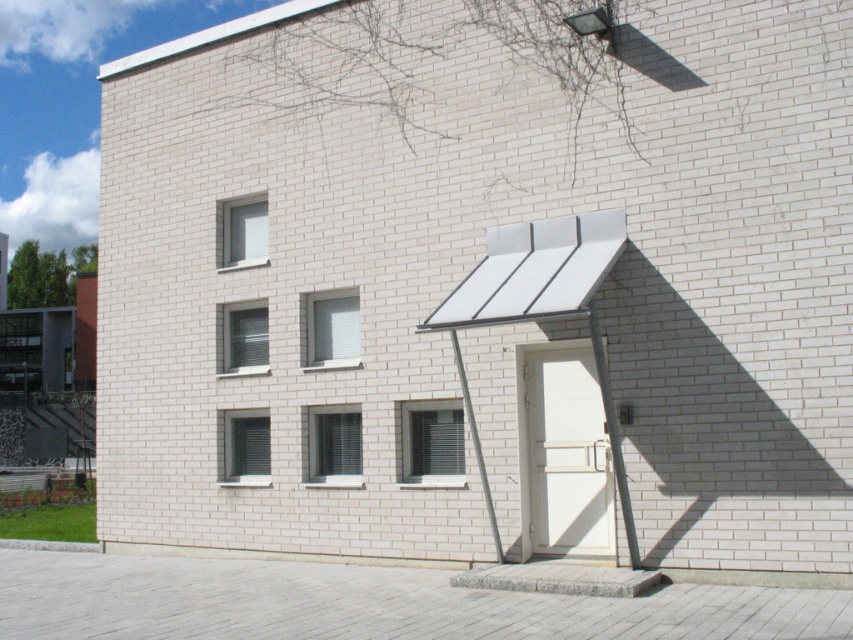
You are an architect designing a new building and want to ensure proper ventilation. You notice the clear glass window at center and the white textured window at lower left. Which window should you open if you want to allow more airflow without blocking the view, considering their heights?

The clear glass window at center has a lesser height compared to the white textured window at lower left, so opening the white textured window at lower left would allow more airflow while maintaining a clear view since it is taller.

You are an architect evaluating the building facade. You notice the white glass window at upper center and the metallic gray pole at center. Which object has a smaller size?

The white glass window at upper center is smaller than the metallic gray pole at center.

You are standing directly in front of the entrance of the two story building. You want to locate the clear glass window at center. Where should you look relative to the entrance?

The clear glass window at center is located at point (334, 445) relative to the entrance, so you should look towards the upper right direction from the entrance to locate it.